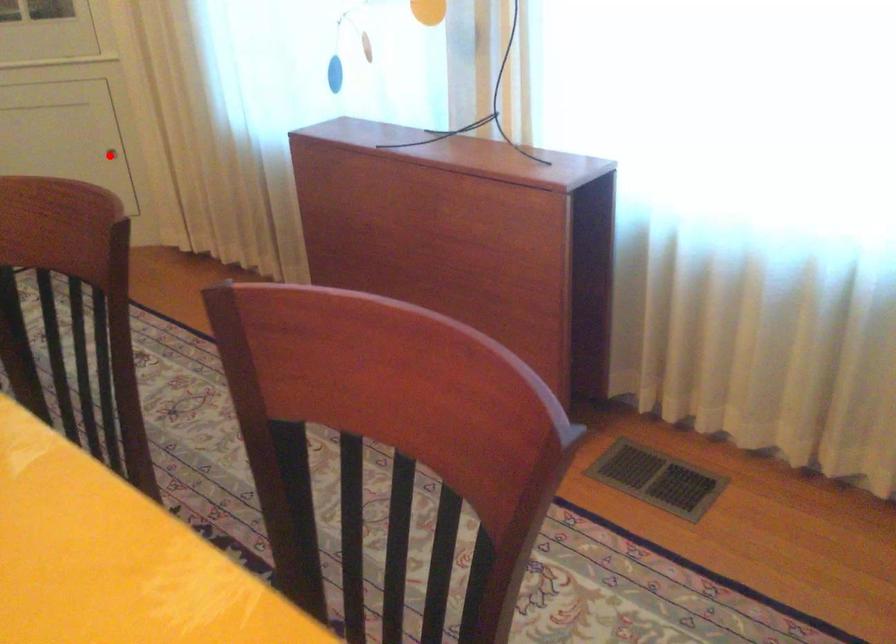
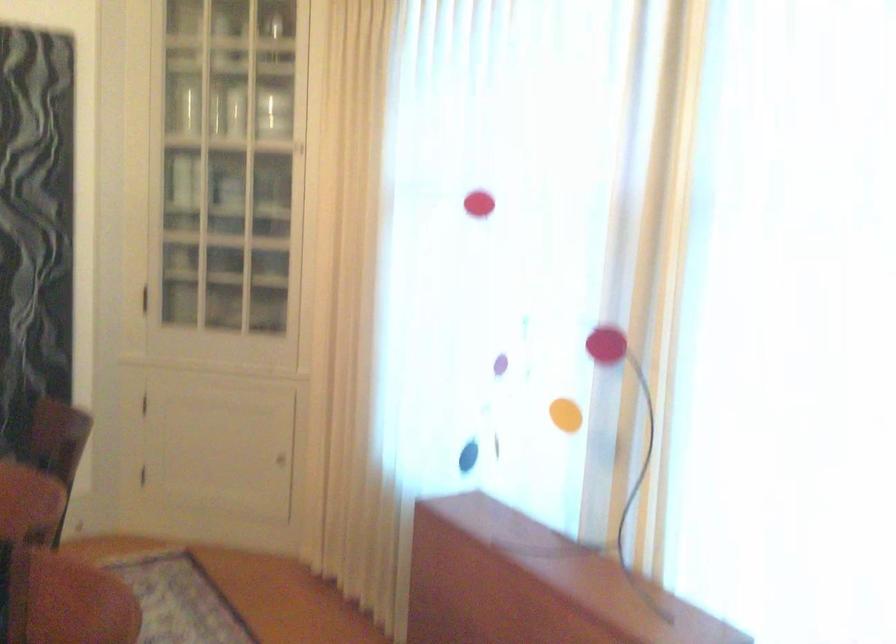
In the second image, find the point that corresponds to the highlighted location in the first image.

(280, 460)